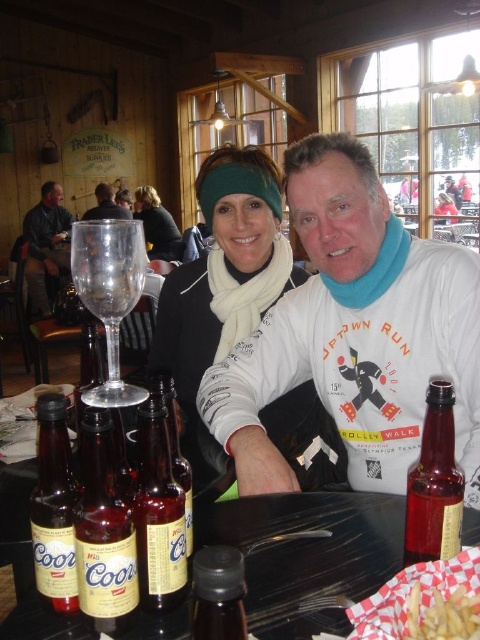
Who is more forward, (x=446, y=387) or (x=434, y=604)?

Point (x=434, y=604) is in front.

Can you confirm if translucent glass bottle at lower right is bigger than golden crispy fries at lower right?

Yes.

Which is in front, point (432, 560) or point (429, 627)?

Point (429, 627) is in front.

The width and height of the screenshot is (480, 640). In order to click on translucent glass bottle at lower right in this screenshot , I will do `click(434, 484)`.

Based on the photo, can you confirm if matte plastic bottles at center is thinner than matte glass beer bottle at center?

No.

Can you confirm if matte plastic bottles at center is positioned below matte glass beer bottle at center?

Yes, matte plastic bottles at center is below matte glass beer bottle at center.

At what (x,y) coordinates should I click in order to perform the action: click on matte plastic bottles at center. Please return your answer as a coordinate pair (x, y). Image resolution: width=480 pixels, height=640 pixels. Looking at the image, I should click on (309, 554).

Can you confirm if golden crispy fries at lower right is thinner than matte black jacket at upper center?

Indeed, golden crispy fries at lower right has a lesser width compared to matte black jacket at upper center.

Is point (419, 611) positioned before point (104, 195)?

That is True.

Locate an element on the screen. The width and height of the screenshot is (480, 640). golden crispy fries at lower right is located at coordinates (443, 616).